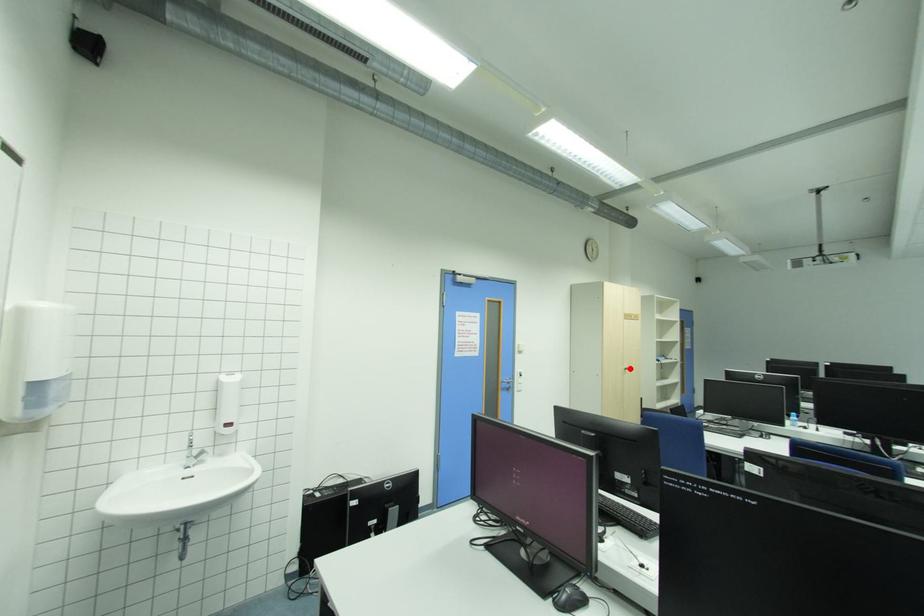
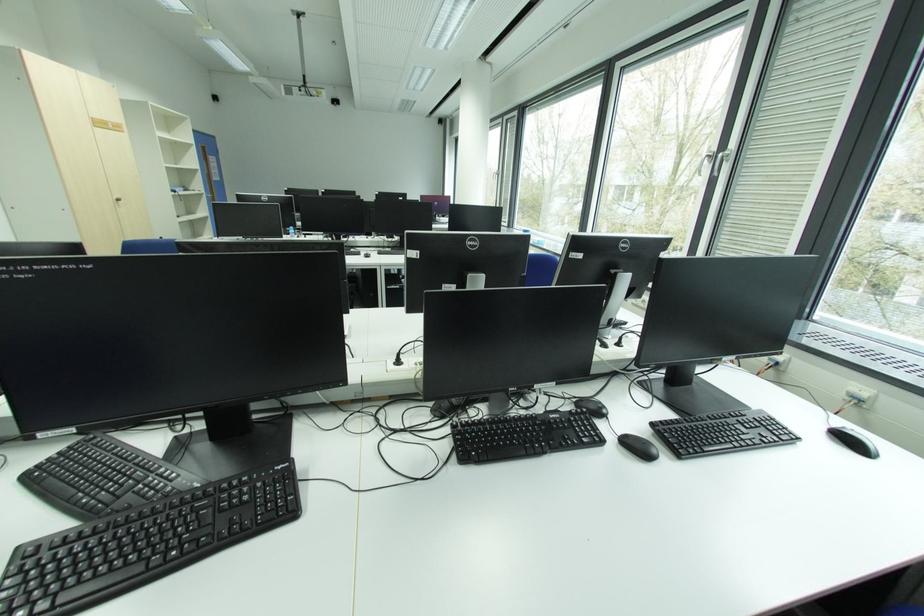
Locate, in the second image, the point that corresponds to the highlighted location in the first image.

(120, 199)